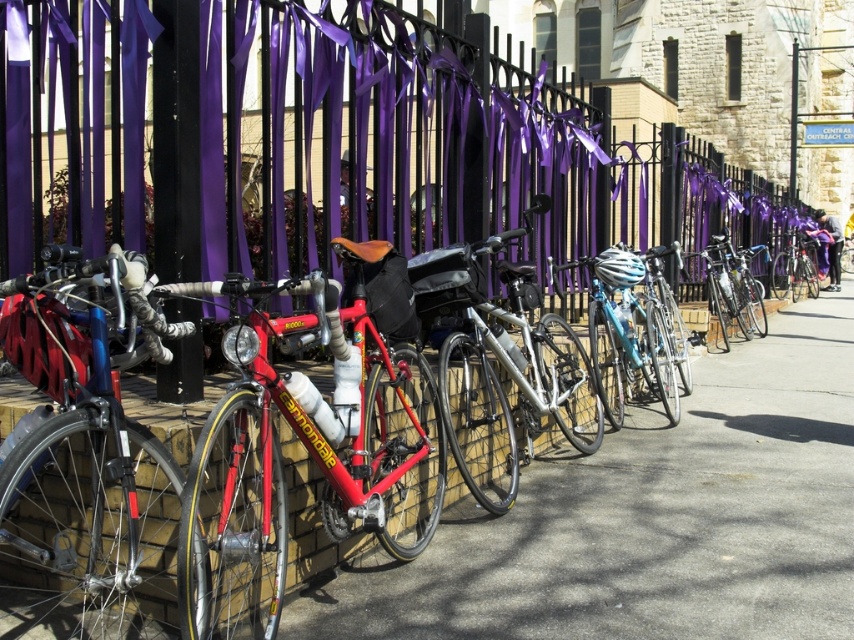
Question: Estimate the real-world distances between objects in this image. Which object is farther from the shiny red bike at center?

Choices:
 (A) shiny blue bicycle at center
 (B) smooth concrete pavement at center
 (C) shiny blue bicycle at left
 (D) metallic black fence at upper center

Answer: (D)

Question: Which object is positioned closest to the silver metallic bicycle at center?

Choices:
 (A) shiny blue bicycle at center
 (B) smooth concrete pavement at center
 (C) metallic black fence at upper center
 (D) shiny blue bicycle at left

Answer: (B)

Question: Is smooth concrete pavement at center to the right of shiny blue bicycle at left from the viewer's perspective?

Choices:
 (A) no
 (B) yes

Answer: (B)

Question: Does metallic black fence at upper center appear on the left side of shiny blue bicycle at center?

Choices:
 (A) yes
 (B) no

Answer: (A)

Question: Which point is closer to the camera?

Choices:
 (A) silver metallic bicycle at center
 (B) shiny red bike at center
 (C) shiny blue bicycle at center

Answer: (B)

Question: Does shiny blue bicycle at left lie behind shiny blue bicycle at center?

Choices:
 (A) yes
 (B) no

Answer: (B)